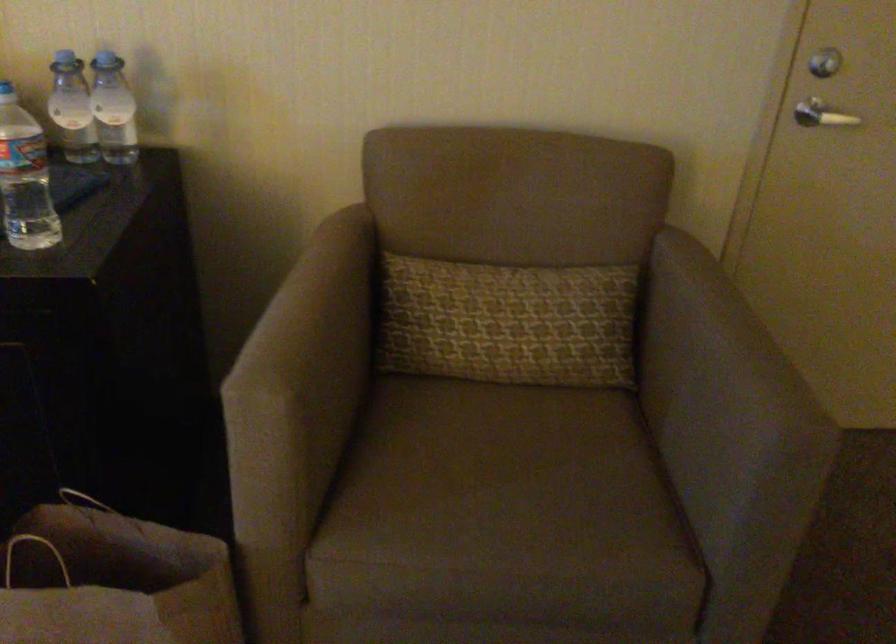
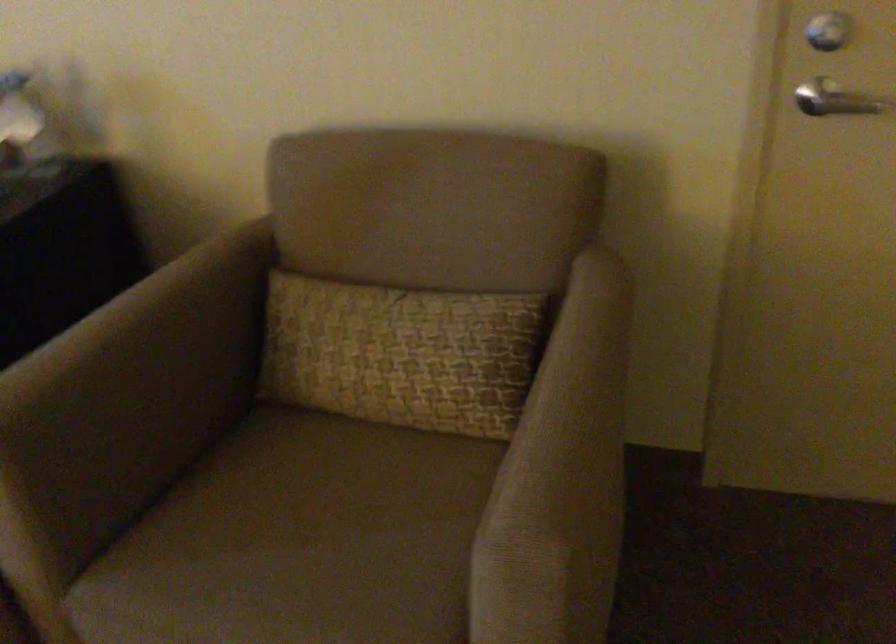
Question: The camera is either moving clockwise (left) or counter-clockwise (right) around the object. The first image is from the beginning of the video and the second image is from the end. Is the camera moving left or right when shooting the video?

Choices:
 (A) Left
 (B) Right

Answer: (B)